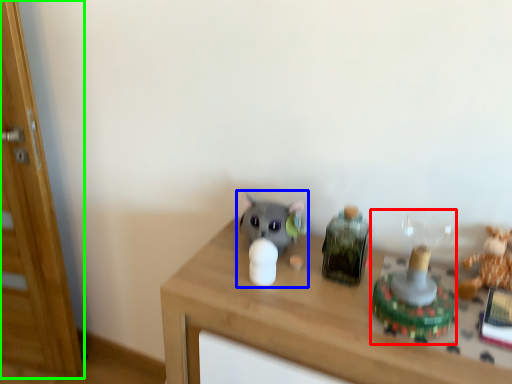
Question: Which object is positioned closest to toy (highlighted by a red box)? Select from toy (highlighted by a blue box) and glass door (highlighted by a green box).

Choices:
 (A) toy
 (B) glass door

Answer: (A)